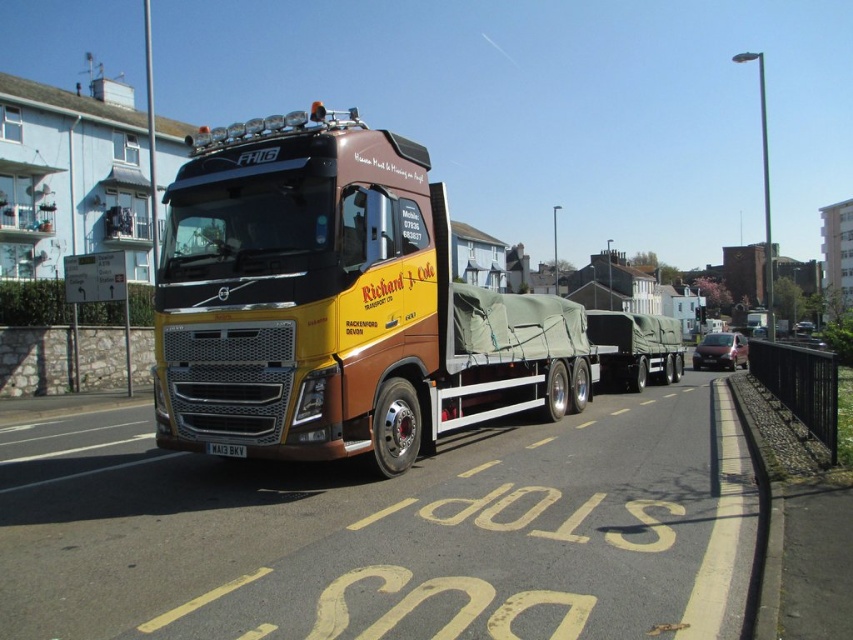
Question: Which object is farther from the camera taking this photo?

Choices:
 (A) white plastic license plate at center
 (B) yellow metallic truck at center

Answer: (A)

Question: From the image, what is the correct spatial relationship of camouflage fabric trailer truck at center in relation to white plastic license plate at center?

Choices:
 (A) below
 (B) above

Answer: (B)

Question: Is the position of yellow metallic truck at center less distant than that of camouflage fabric trailer truck at center?

Choices:
 (A) no
 (B) yes

Answer: (B)

Question: Is yellow metallic truck at center bigger than camouflage fabric trailer truck at center?

Choices:
 (A) no
 (B) yes

Answer: (B)

Question: Which object is closer to the camera taking this photo?

Choices:
 (A) yellow metallic truck at center
 (B) white plastic license plate at center

Answer: (A)

Question: Among these points, which one is farthest from the camera?

Choices:
 (A) (212, 454)
 (B) (289, 241)

Answer: (A)